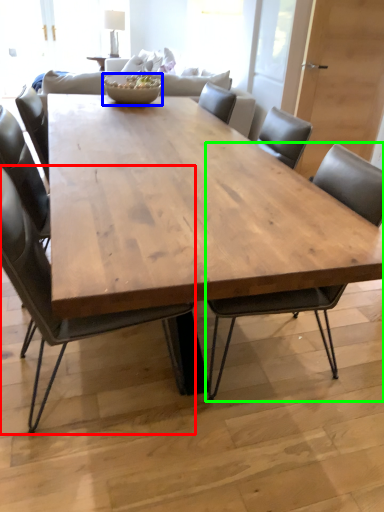
Question: Which is nearer to the chair (highlighted by a red box)? bowl (highlighted by a blue box) or chair (highlighted by a green box).

Choices:
 (A) bowl
 (B) chair

Answer: (B)